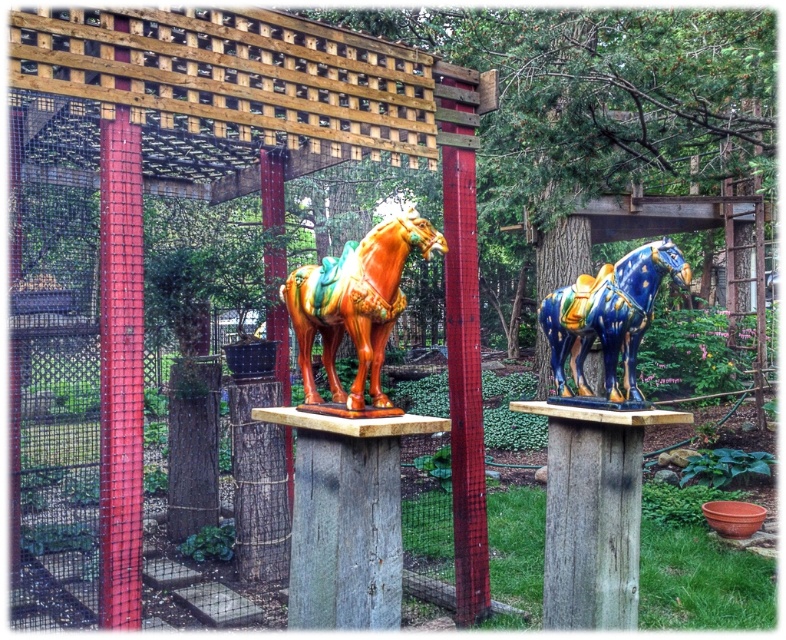
Question: Does shiny orange horse at center appear under blue glossy horse at center?

Choices:
 (A) yes
 (B) no

Answer: (B)

Question: Can you confirm if shiny orange horse at center is smaller than blue glossy horse at center?

Choices:
 (A) no
 (B) yes

Answer: (B)

Question: Among these points, which one is nearest to the camera?

Choices:
 (A) (608, 280)
 (B) (414, 225)

Answer: (B)

Question: Is shiny orange horse at center bigger than blue glossy horse at center?

Choices:
 (A) no
 (B) yes

Answer: (A)

Question: Which of the following is the closest to the observer?

Choices:
 (A) (568, 333)
 (B) (347, 410)

Answer: (B)